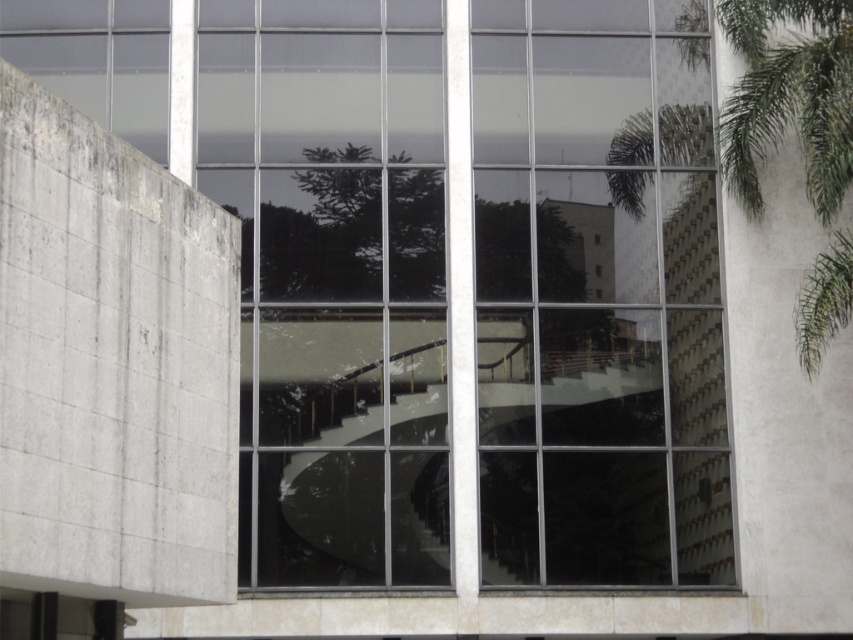
Question: Estimate the real-world distances between objects in this image. Which object is closer to the transparent glass window at center?

Choices:
 (A) green leafy tree at center
 (B) green leafy palm tree at right

Answer: (A)

Question: Which of the following is the closest to the observer?

Choices:
 (A) (242, 236)
 (B) (808, 173)
 (C) (395, 195)

Answer: (B)

Question: Does transparent glass window at center come behind green leafy palm tree at right?

Choices:
 (A) yes
 (B) no

Answer: (A)

Question: Among these points, which one is farthest from the camera?

Choices:
 (A) (833, 157)
 (B) (293, 195)
 (C) (640, 264)

Answer: (C)

Question: Does green leafy palm tree at right have a lesser width compared to green leafy tree at center?

Choices:
 (A) yes
 (B) no

Answer: (A)

Question: Considering the relative positions of transparent glass window at center and green leafy palm tree at right in the image provided, where is transparent glass window at center located with respect to green leafy palm tree at right?

Choices:
 (A) left
 (B) right

Answer: (A)